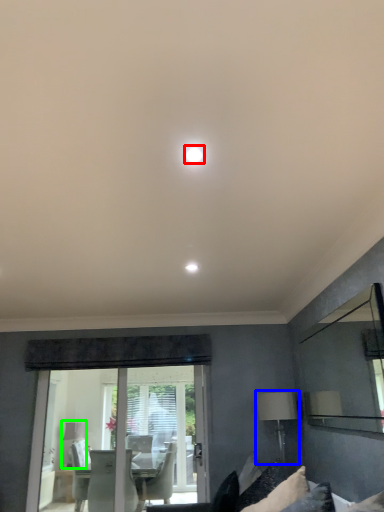
Question: Considering the real-world distances, which object is farthest from lighting (highlighted by a red box)? table lamp (highlighted by a blue box) or table lamp (highlighted by a green box)?

Choices:
 (A) table lamp
 (B) table lamp

Answer: (B)